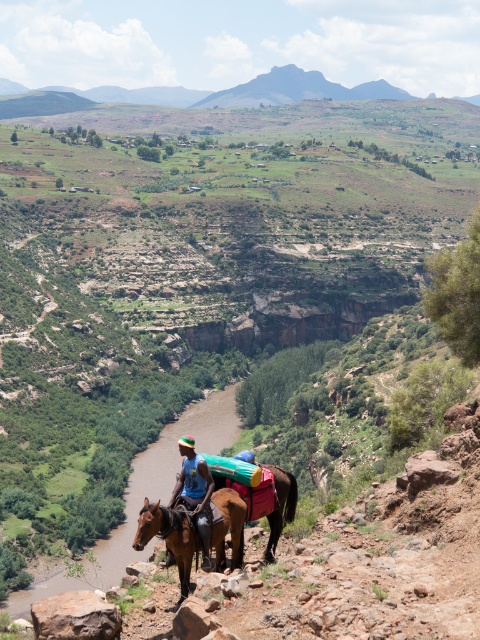
Can you confirm if brown glossy horse at lower center is wider than brown leather donkey at center?

Indeed, brown glossy horse at lower center has a greater width compared to brown leather donkey at center.

Does brown glossy horse at lower center appear over brown leather donkey at center?

No, brown glossy horse at lower center is not above brown leather donkey at center.

Locate an element on the screen. Image resolution: width=480 pixels, height=640 pixels. brown glossy horse at lower center is located at coordinates (168, 536).

Who is lower down, brown glossy horse at lower center or blue fabric shirt at center?

blue fabric shirt at center is below.

Is brown glossy horse at lower center taller than blue fabric shirt at center?

No.

What do you see at coordinates (168, 536) in the screenshot? I see `brown glossy horse at lower center` at bounding box center [168, 536].

Where is `brown glossy horse at lower center`? brown glossy horse at lower center is located at coordinates (168, 536).

Is brown leather donkey at center below blue fabric shirt at center?

No.

Between brown leather donkey at center and blue fabric shirt at center, which one has less height?

Standing shorter between the two is brown leather donkey at center.

Does point (291, 483) come farther from viewer compared to point (195, 509)?

Yes, point (291, 483) is behind point (195, 509).

Find the location of `brown leather donkey at center`. brown leather donkey at center is located at coordinates (266, 500).